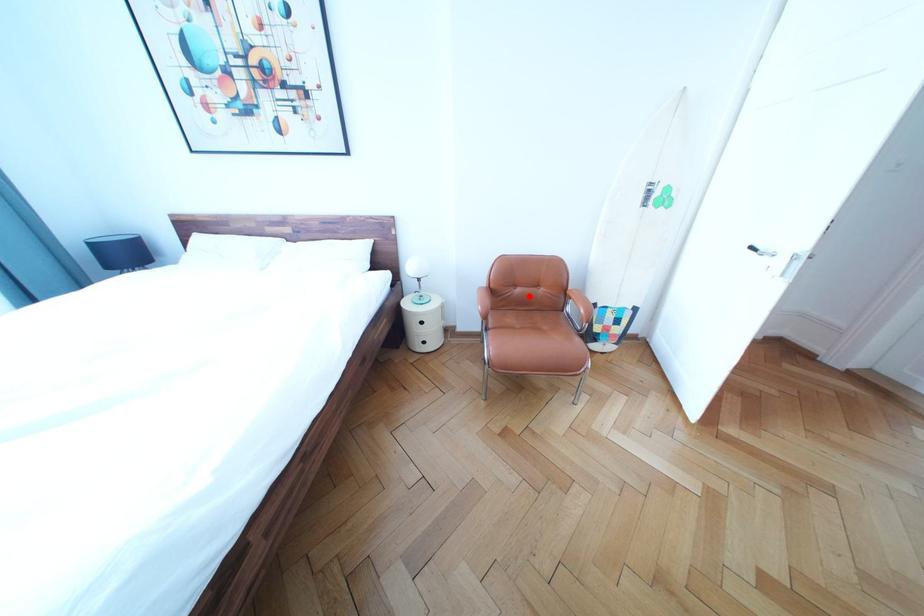
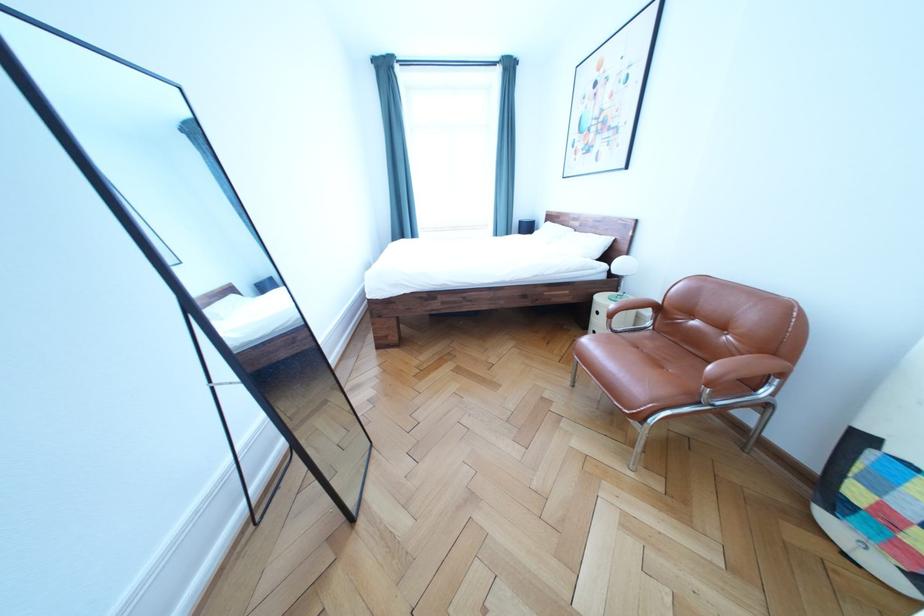
Question: I am providing you with two images of the same scene from different viewpoints. Given a red point in image1, look at the same physical point in image2. Is it:

Choices:
 (A) Closer to the viewpoint
 (B) Farther from the viewpoint

Answer: (A)